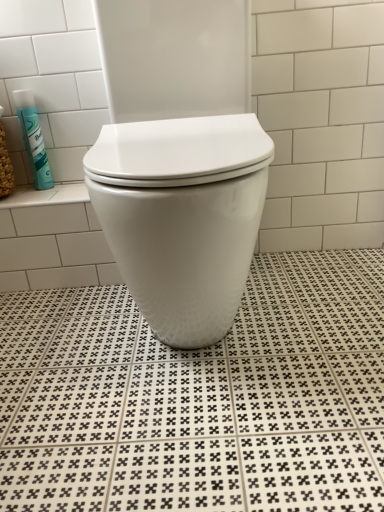
Describe the element at coordinates (33, 138) in the screenshot. Image resolution: width=384 pixels, height=512 pixels. I see `teal plastic spray bottle at left` at that location.

Find the location of a particular element. teal plastic spray bottle at left is located at coordinates (33, 138).

At what (x,y) coordinates should I click in order to perform the action: click on teal plastic spray bottle at left. Please return your answer as a coordinate pair (x, y). The width and height of the screenshot is (384, 512). Looking at the image, I should click on (33, 138).